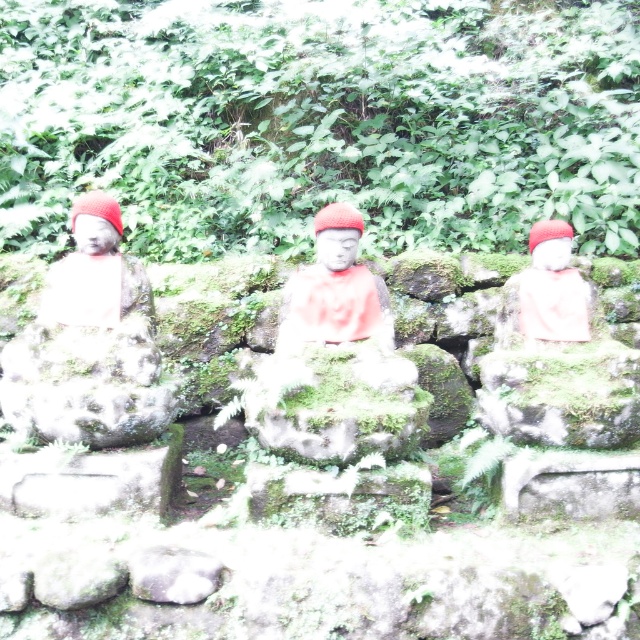
Which is more to the right, white stone monk at left or matte white statue at right?

Positioned to the right is matte white statue at right.

Can you confirm if white stone monk at left is positioned below matte white statue at right?

Actually, white stone monk at left is above matte white statue at right.

Which is behind, point (84, 252) or point (556, 291)?

Point (556, 291)

What are the coordinates of `white stone monk at left` in the screenshot? It's located at (96, 269).

Can you confirm if matte red statue at center is positioned below white stone monk at left?

Indeed, matte red statue at center is positioned under white stone monk at left.

Between point (333, 248) and point (93, 252), which one is positioned in front?

Point (333, 248)

Is point (349, 307) positioned before point (49, 289)?

That is True.

Locate an element on the screen. matte red statue at center is located at coordinates (336, 289).

Between matte stone statue at left and matte white statue at right, which one is positioned lower?

Positioned lower is matte stone statue at left.

The width and height of the screenshot is (640, 640). Describe the element at coordinates (90, 344) in the screenshot. I see `matte stone statue at left` at that location.

This screenshot has width=640, height=640. I want to click on matte stone statue at left, so 90,344.